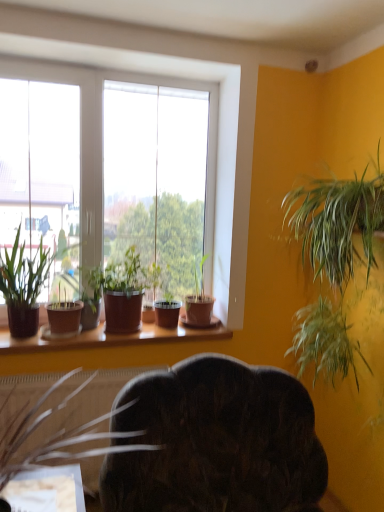
Question: Which direction should I rotate to look at matte brown pot at window, which appears as the second houseplant when viewed from the right?

Choices:
 (A) left
 (B) right

Answer: (B)

Question: Is the depth of green leafy plant at right, the first houseplant from the right, less than that of matte brown pot at window, the 3th houseplant from the left?

Choices:
 (A) yes
 (B) no

Answer: (A)

Question: Does green leafy plant at right, the first houseplant from the right, appear on the left side of matte brown pot at window, the 3th houseplant from the left?

Choices:
 (A) yes
 (B) no

Answer: (B)

Question: From a real-world perspective, does green leafy plant at right, the first houseplant from the right, sit lower than matte brown pot at window, the 3th houseplant from the left?

Choices:
 (A) yes
 (B) no

Answer: (B)

Question: Can you confirm if green leafy plant at right, which appears as the 6th houseplant when viewed from the left, is smaller than matte brown pot at window, the fourth houseplant positioned from the right?

Choices:
 (A) yes
 (B) no

Answer: (B)

Question: From the image's perspective, does green leafy plant at right, which appears as the 6th houseplant when viewed from the left, appear higher than matte brown pot at window, the fourth houseplant positioned from the right?

Choices:
 (A) no
 (B) yes

Answer: (B)

Question: From a real-world perspective, is green leafy plant at right, the first houseplant from the right, on matte brown pot at window, the fourth houseplant positioned from the right?

Choices:
 (A) yes
 (B) no

Answer: (A)

Question: From the image's perspective, does green leafy plant at right, the first houseplant from the right, appear lower than brown matte pot at lower left, marked as the fifth houseplant in a right-to-left arrangement?

Choices:
 (A) yes
 (B) no

Answer: (B)

Question: Is green leafy plant at right, the first houseplant from the right, bigger than brown matte pot at lower left, marked as the fifth houseplant in a right-to-left arrangement?

Choices:
 (A) no
 (B) yes

Answer: (B)

Question: From a real-world perspective, is green leafy plant at right, the first houseplant from the right, under brown matte pot at lower left, positioned as the second houseplant in left-to-right order?

Choices:
 (A) no
 (B) yes

Answer: (A)

Question: From a real-world perspective, does green leafy plant at right, the first houseplant from the right, stand above brown matte pot at lower left, positioned as the second houseplant in left-to-right order?

Choices:
 (A) no
 (B) yes

Answer: (B)

Question: Does green leafy plant at right, which appears as the 6th houseplant when viewed from the left, have a greater width compared to brown matte pot at lower left, marked as the fifth houseplant in a right-to-left arrangement?

Choices:
 (A) yes
 (B) no

Answer: (B)

Question: From the image's perspective, is green leafy plant at right, the first houseplant from the right, above brown matte pot at lower left, positioned as the second houseplant in left-to-right order?

Choices:
 (A) no
 (B) yes

Answer: (B)

Question: From a real-world perspective, is brown matte pot at lower left, positioned as the second houseplant in left-to-right order, located higher than green leafy plant at right, the first houseplant from the right?

Choices:
 (A) yes
 (B) no

Answer: (B)